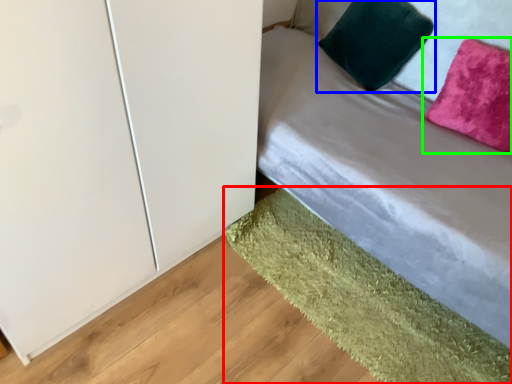
Question: Estimate the real-world distances between objects in this image. Which object is farther from mat (highlighted by a red box), pillow (highlighted by a blue box) or pillow (highlighted by a green box)?

Choices:
 (A) pillow
 (B) pillow

Answer: (A)